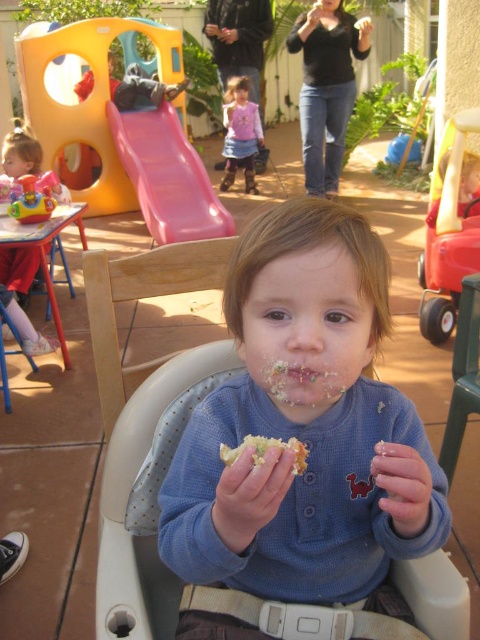
You are holding a 70 cm long ruler and want to measure the distance between yourself and the point at coordinates point (273, 420). Can you reach it with your ruler?

The distance between you and the point (273, 420) is 78.83 centimeters. Since your ruler is only 70 cm long, you cannot reach it with your ruler.

You are a photographer standing at the back of the scene. You want to take a photo that includes both the blue soft shirt at center and the pink fabric dress at center. Which object should you focus on first to ensure both are in clear view?

The blue soft shirt at center is closer to the viewer than the pink fabric dress at center, so you should focus on the blue soft shirt at center first to ensure both are in clear view.